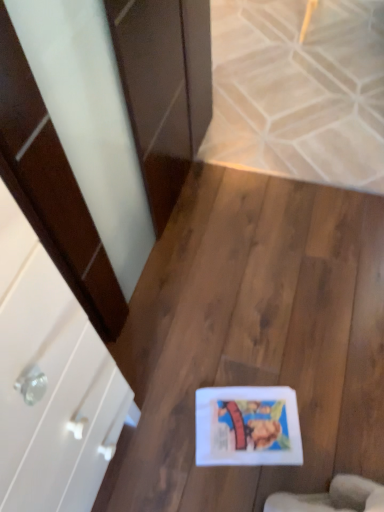
The image size is (384, 512). I want to click on free spot behind white glossy cabinet at left, so click(155, 362).